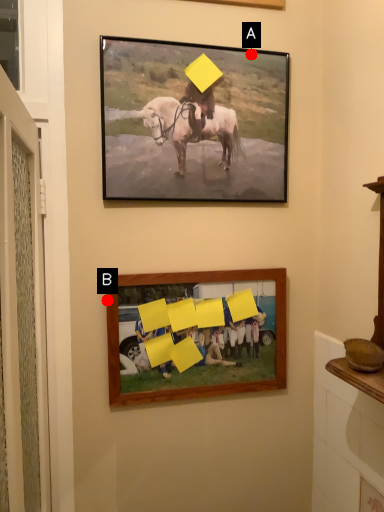
Question: Two points are circled on the image, labeled by A and B beside each circle. Which of the following is the closest to the observer?

Choices:
 (A) A is closer
 (B) B is closer

Answer: (B)